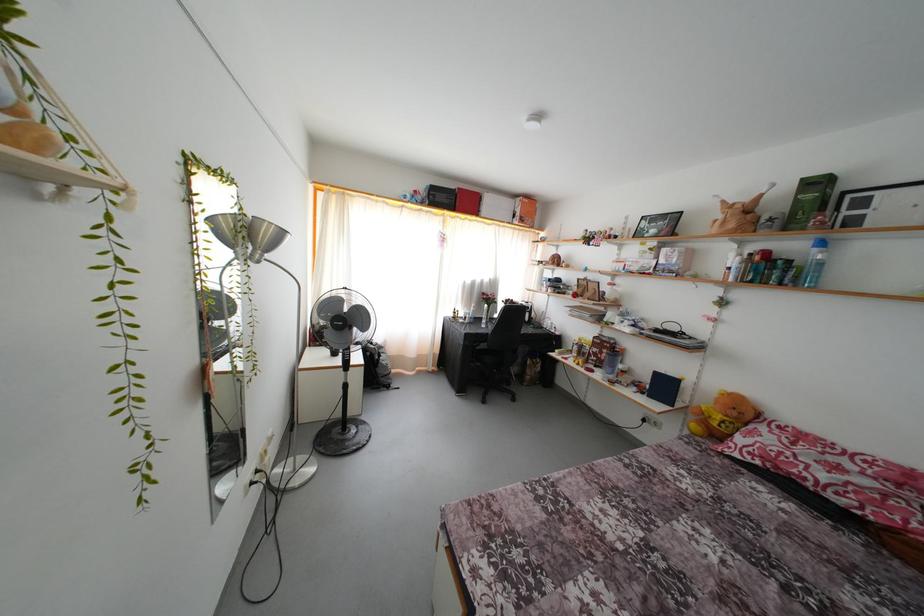
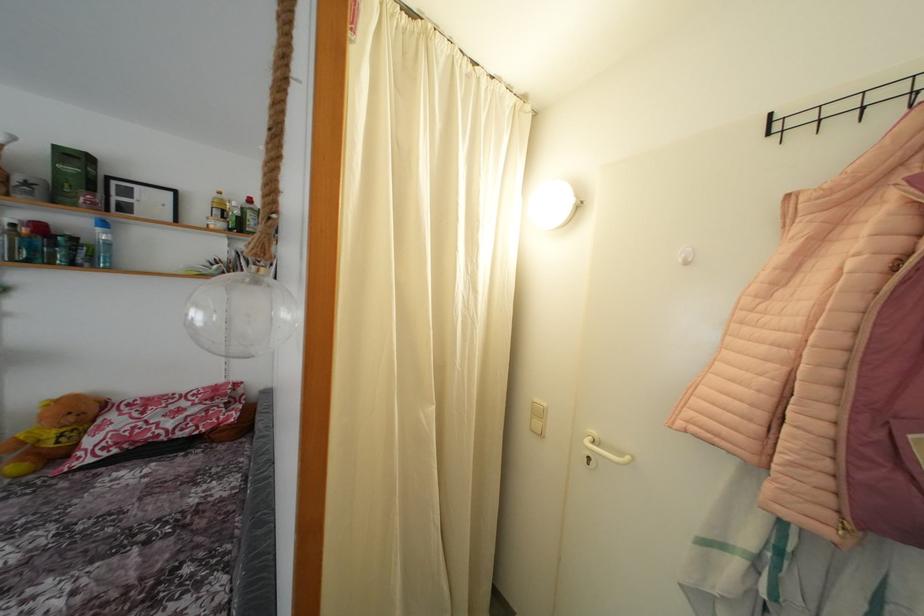
Where in the second image is the point corresponding to (x=738, y=419) from the first image?

(77, 424)